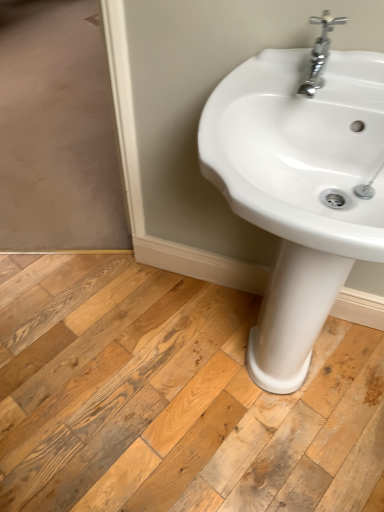
This screenshot has height=512, width=384. Find the location of `free location to the left of chrome metallic faucet at upper right`. free location to the left of chrome metallic faucet at upper right is located at coordinates (251, 88).